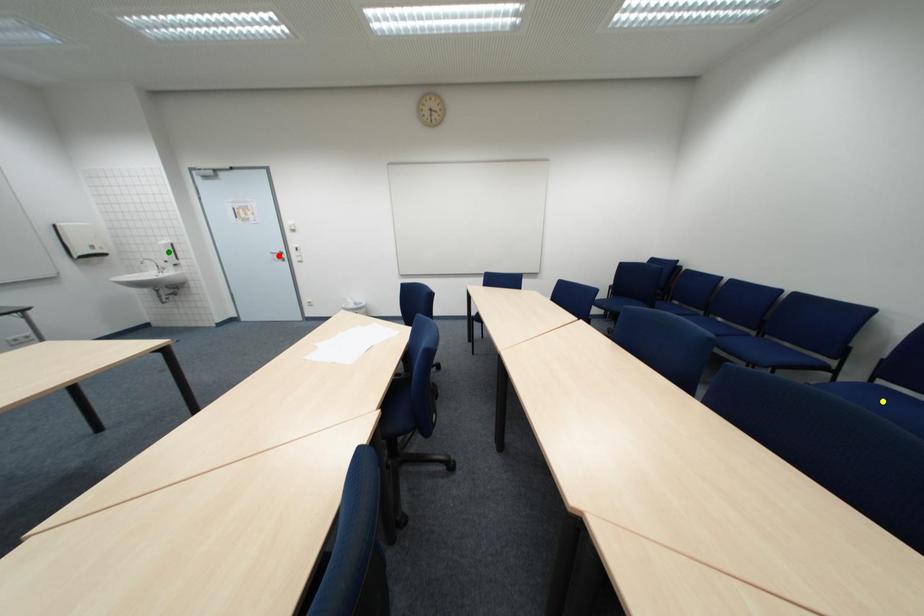
Order these from nearest to farthest:
A) yellow point
B) green point
C) red point

1. yellow point
2. green point
3. red point